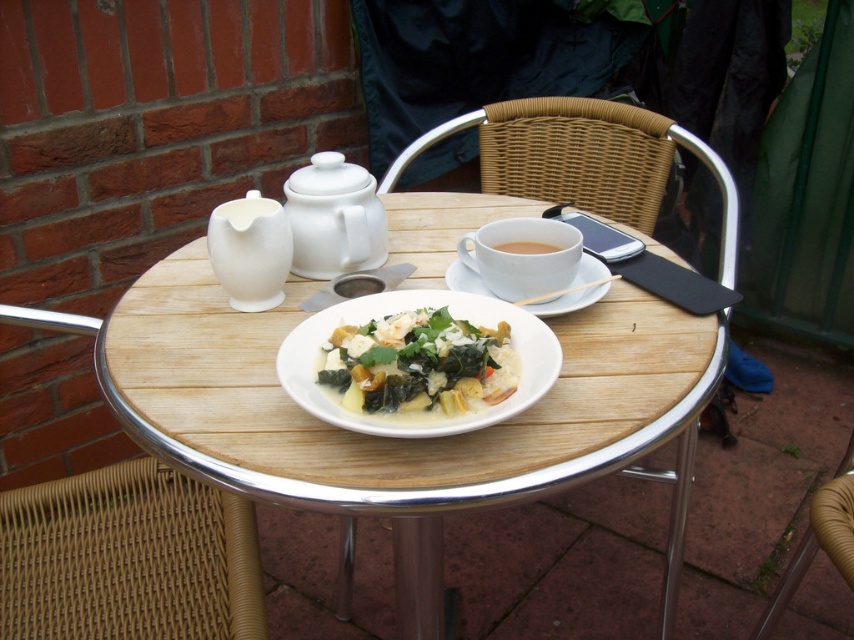
You are setting up a tea service and need to place the white glossy teapot at upper left and the white ceramic cup at center on the table. Which item should you place first if you want to ensure the taller object is positioned where it won

The white glossy teapot at upper left is taller than the white ceramic cup at center. Since it is taller, you should place it first to ensure proper positioning.

Based on the photo, you are setting up a picnic and want to place a napkin on the white ceramic saucer at center. However, there is a woven wicker chair at center in the way. Can you place the napkin on the saucer without moving the chair?

The woven wicker chair at center is positioned over white ceramic saucer at center, so you cannot place the napkin on the saucer without moving the chair.

You are a person who is 1.7 meters tall and standing near the table in the image. You want to sit down on the woven wicker chair at lower left. Can you reach the table comfortably without needing to stretch too far?

The distance between the woven wicker chair at lower left and the viewer is 82.84 centimeters. Since the chair is close enough, you can sit comfortably and reach the table without stretching too far.